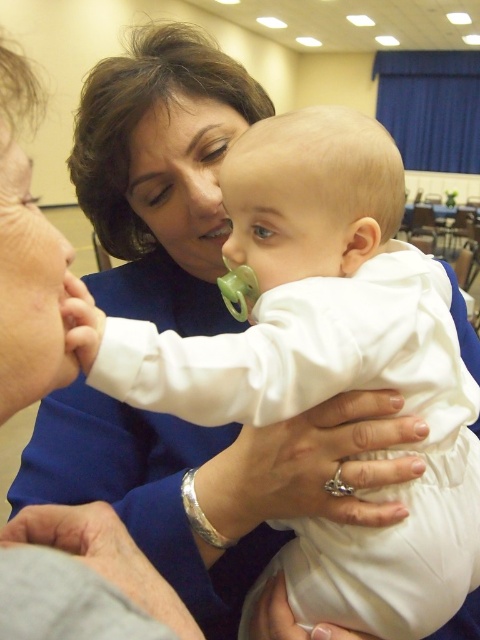
Does matte green pacifier at center lie behind silver metallic teething ring at center?

That is True.

The height and width of the screenshot is (640, 480). I want to click on matte green pacifier at center, so click(216, 230).

The image size is (480, 640). I want to click on matte green pacifier at center, so click(216, 230).

Is white matte pacifier at center taller than matte green pacifier at center?

Yes, white matte pacifier at center is taller than matte green pacifier at center.

Which is in front, point (330, 244) or point (200, 236)?

Point (330, 244)

Who is more distant from viewer, (372, 163) or (222, 230)?

The point (222, 230) is more distant.

Identify the location of white matte pacifier at center. (292, 285).

Who is positioned more to the left, white matte pacifier at center or silver metallic teething ring at center?

silver metallic teething ring at center

Is point (384, 342) closer to camera compared to point (348, 492)?

That is True.

What are the coordinates of `white matte pacifier at center` in the screenshot? It's located at (292, 285).